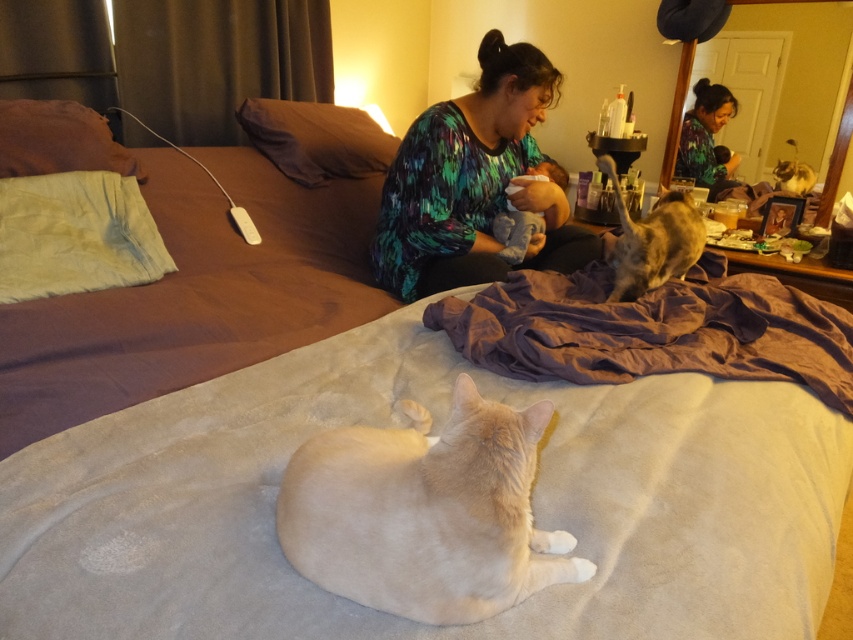
You are a delivery robot that needs to place a small package between the brown fabric pillow at upper center and the green printed shirt at upper center. The package is 1.5 meters long. Can you fit it between them without moving either object?

The distance between the brown fabric pillow at upper center and the green printed shirt at upper center is 1.38 meters. Since the package is 1.5 meters long, it cannot fit between them without moving either object.

You are standing in the bedroom and want to place a small gift on the bed. The gift requires a spot that is exactly 74.35 centimeters away from you. Can you use the point marked at coordinates point (316,573) for this purpose?

Yes, the point marked at coordinates point (316,573) is exactly 74.35 centimeters away from the viewer, so it is suitable for placing the gift.

You are a cat trying to reach the brown fabric pillow at upper center from the beige soft blanket at center. Can you jump up to it?

The beige soft blanket at center is closer to the viewer than the brown fabric pillow at upper center, so the distance between them makes it possible for the cat to jump up to the brown fabric pillow at upper center.